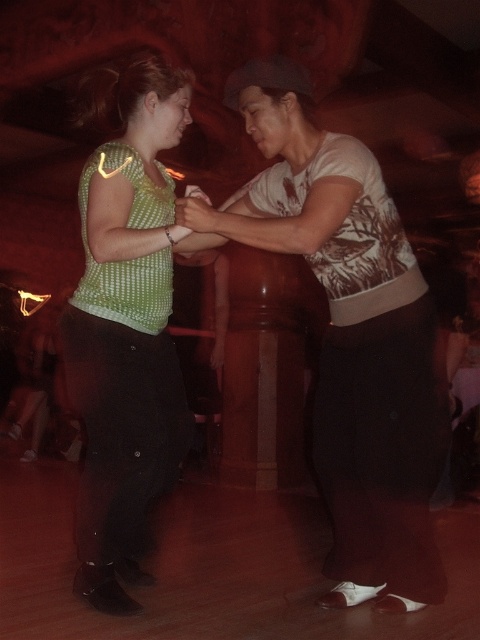
You are a photographer at a dance event and need to capture a clear photo of both the green dotted shirt at center and the green dotted blouse at center. Since the camera can only focus on one subject at a time, which one should you choose to ensure the details are clearer?

The green dotted shirt at center has a larger size compared to the green dotted blouse at center, so choosing to focus on the green dotted shirt at center would allow for clearer details due to its larger size.

You are a photographer at a dance event and want to capture a photo of the green dotted shirt at center and the green dotted blouse at center. Which one is on the right side when facing the dancers?

The green dotted shirt at center is positioned on the right side of the green dotted blouse at center, so the shirt is on the right when facing the dancers.